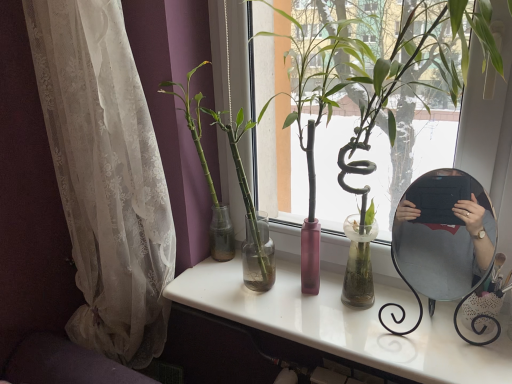
At what (x,y) coordinates should I click in order to perform the action: click on vacant space underneath green glossy bamboo at center, which is the second houseplant from left to right (from a real-world perspective). Please return your answer as a coordinate pair (x, y). The width and height of the screenshot is (512, 384). Looking at the image, I should click on (406, 335).